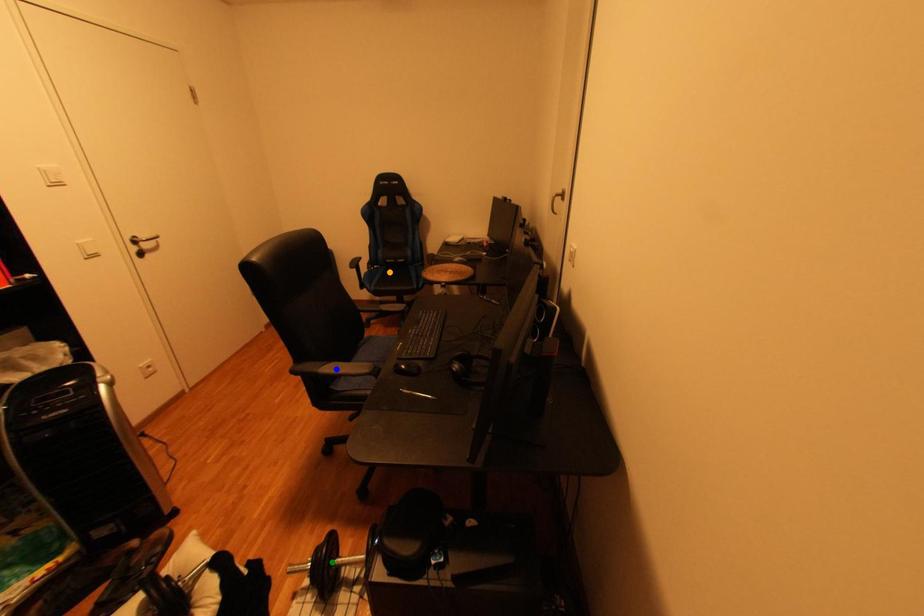
Order these from nearest to farthest:
orange point
green point
blue point

1. orange point
2. blue point
3. green point